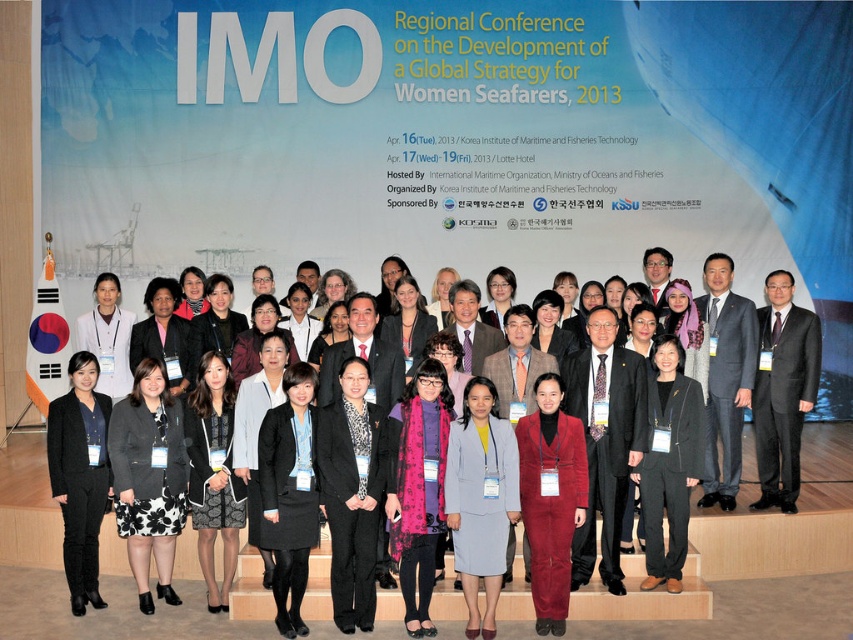
Question: Which point is farther to the camera?

Choices:
 (A) black floral dress at lower left
 (B) black suit at center

Answer: (B)

Question: Can you confirm if black floral dress at lower left is positioned above dark gray suit at right?

Choices:
 (A) no
 (B) yes

Answer: (A)

Question: Which object is positioned closest to the matte black suit at center?

Choices:
 (A) black fabric pants at center
 (B) black floral dress at lower left
 (C) dark gray suit at right
 (D) black textured suit at center

Answer: (C)

Question: Is black suit at lower left below dark gray suit at right?

Choices:
 (A) yes
 (B) no

Answer: (A)

Question: Can you confirm if black textured suit at center is positioned below dark gray suit at right?

Choices:
 (A) yes
 (B) no

Answer: (A)

Question: Which object is farther from the camera taking this photo?

Choices:
 (A) black suit at center
 (B) matte black suit at center
 (C) dark gray suit at right

Answer: (A)